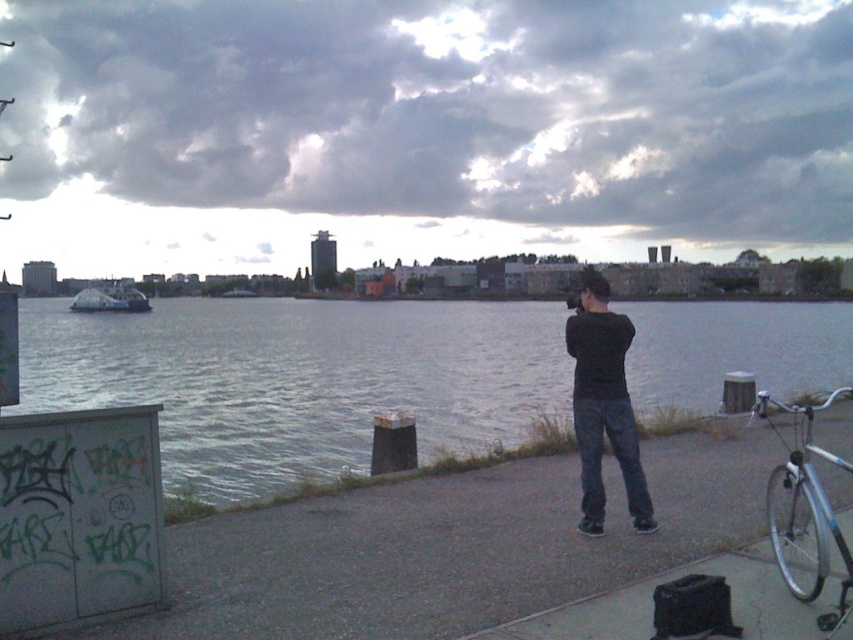
You are a photographer setting up equipment on the paved pathway. You have a tripod that requires 1.2 meters of space. There is a black matte pants at center and a silver metallic bicycle at right nearby. Can you fit your tripod between them without moving either object?

The black matte pants at center is wider than the silver metallic bicycle at right. Since the black matte pants at center is wider, there might be sufficient space between them to accommodate the tripod, but the exact distance isn

You are standing on the riverside pathway and notice the gray water at center and the black matte pants at center. Which object is positioned lower in the scene?

The gray water at center is located below the black matte pants at center, so it is positioned lower in the scene.

You are standing on the riverside path and notice the gray water at center and the black matte pants at center. Which object is taller?

The black matte pants at center are taller than the gray water at center.